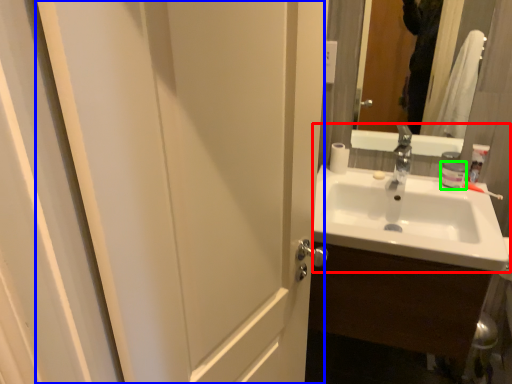
Question: Considering the real-world distances, which object is closest to sink (highlighted by a red box)? screen door (highlighted by a blue box) or toiletry (highlighted by a green box).

Choices:
 (A) screen door
 (B) toiletry

Answer: (B)